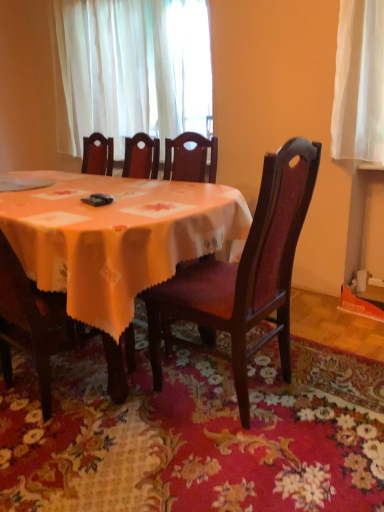
Question: Can you confirm if matte wood chair at center, which appears as the second chair when viewed from the left, is bigger than matte orange tablecloth at center?

Choices:
 (A) yes
 (B) no

Answer: (B)

Question: From the image's perspective, is matte wood chair at center, which appears as the second chair when viewed from the left, on matte orange tablecloth at center?

Choices:
 (A) yes
 (B) no

Answer: (B)

Question: Is matte wood chair at center, which appears as the second chair when viewed from the left, to the left of matte orange tablecloth at center from the viewer's perspective?

Choices:
 (A) yes
 (B) no

Answer: (B)

Question: Does matte wood chair at center, which appears as the second chair when viewed from the left, have a greater width compared to matte orange tablecloth at center?

Choices:
 (A) no
 (B) yes

Answer: (A)

Question: From the image's perspective, is matte wood chair at center, which is the first chair in right-to-left order, below matte orange tablecloth at center?

Choices:
 (A) no
 (B) yes

Answer: (B)

Question: Which is correct: white glossy plate at upper left is inside white sheer curtain at upper center, or outside of it?

Choices:
 (A) inside
 (B) outside

Answer: (B)

Question: Based on their sizes in the image, would you say white glossy plate at upper left is bigger or smaller than white sheer curtain at upper center?

Choices:
 (A) big
 (B) small

Answer: (B)

Question: Is point (16, 189) positioned closer to the camera than point (77, 142)?

Choices:
 (A) closer
 (B) farther

Answer: (A)

Question: From the image's perspective, is white glossy plate at upper left positioned above or below white sheer curtain at upper center?

Choices:
 (A) below
 (B) above

Answer: (A)

Question: Relative to wooden chair at center, the 2th chair when ordered from right to left, is matte orange tablecloth at center in front or behind?

Choices:
 (A) behind
 (B) front

Answer: (B)

Question: Looking at their shapes, would you say matte orange tablecloth at center is wider or thinner than wooden chair at center, the first chair when ordered from left to right?

Choices:
 (A) thin
 (B) wide

Answer: (B)

Question: Considering the positions of matte orange tablecloth at center and wooden chair at center, the first chair when ordered from left to right, in the image, is matte orange tablecloth at center taller or shorter than wooden chair at center, the first chair when ordered from left to right,?

Choices:
 (A) short
 (B) tall

Answer: (A)

Question: Is point (82, 317) positioned closer to the camera than point (1, 324)?

Choices:
 (A) farther
 (B) closer

Answer: (B)

Question: From the image's perspective, is wooden chair at center, the first chair when ordered from left to right, above or below matte wood chair at center, which is the first chair in right-to-left order?

Choices:
 (A) below
 (B) above

Answer: (A)

Question: Considering the positions of wooden chair at center, the 2th chair when ordered from right to left, and matte wood chair at center, which is the first chair in right-to-left order, in the image, is wooden chair at center, the 2th chair when ordered from right to left, bigger or smaller than matte wood chair at center, which is the first chair in right-to-left order,?

Choices:
 (A) big
 (B) small

Answer: (B)